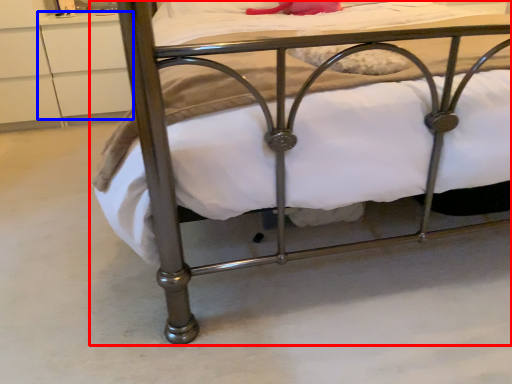
Question: Which point is further to the camera, bed (highlighted by a red box) or drawer (highlighted by a blue box)?

Choices:
 (A) bed
 (B) drawer

Answer: (B)